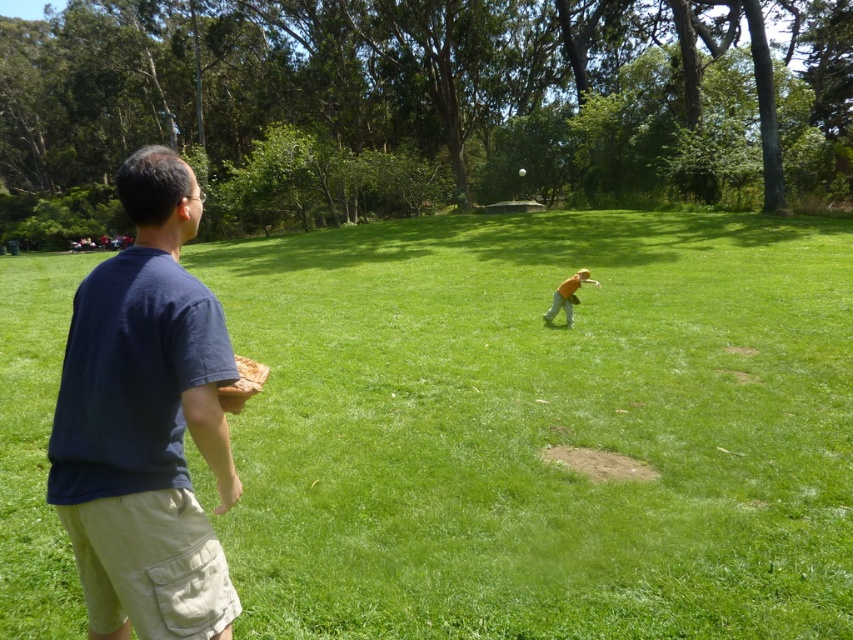
Question: Which point is farther to the camera?

Choices:
 (A) (102, 454)
 (B) (549, 316)
 (C) (573, 300)

Answer: (B)

Question: Which is farther from the brown leather glove at center?

Choices:
 (A) orange cotton shirt at center
 (B) green grassy field at center
 (C) dark blue t-shirt at left

Answer: (C)

Question: Is dark blue t-shirt at left thinner than white matte baseball at center?

Choices:
 (A) no
 (B) yes

Answer: (A)

Question: Which point appears closest to the camera in this image?

Choices:
 (A) (520, 170)
 (B) (222, 394)

Answer: (B)

Question: In this image, where is orange cotton shirt at center located relative to brown leather glove at center?

Choices:
 (A) left
 (B) right

Answer: (A)

Question: Is dark blue t-shirt at left positioned in front of brown leather glove at center?

Choices:
 (A) no
 (B) yes

Answer: (B)